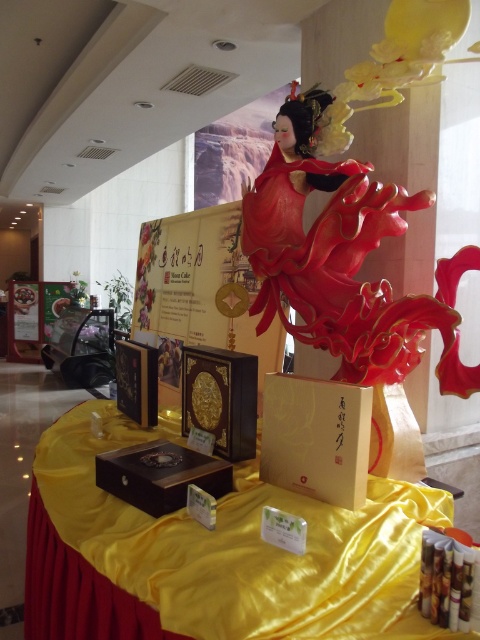
Question: Estimate the real-world distances between objects in this image. Which object is closer to the yellow satin table at center?

Choices:
 (A) wooden box at center
 (B) matte gold cardboard box at center
 (C) glossy red dress at center

Answer: (A)

Question: Is glossy red dress at center closer to the viewer compared to wooden box at center?

Choices:
 (A) yes
 (B) no

Answer: (B)

Question: Among these points, which one is farthest from the camera?

Choices:
 (A) (383, 596)
 (B) (459, 384)

Answer: (B)

Question: Does glossy red dress at center appear on the right side of matte gold cardboard box at center?

Choices:
 (A) no
 (B) yes

Answer: (B)

Question: Which object appears farthest from the camera in this image?

Choices:
 (A) wooden box at center
 (B) glossy red dress at center
 (C) matte gold cardboard box at center
 (D) yellow satin table at center

Answer: (B)

Question: Considering the relative positions of yellow satin table at center and glossy red dress at center in the image provided, where is yellow satin table at center located with respect to glossy red dress at center?

Choices:
 (A) right
 (B) left

Answer: (B)